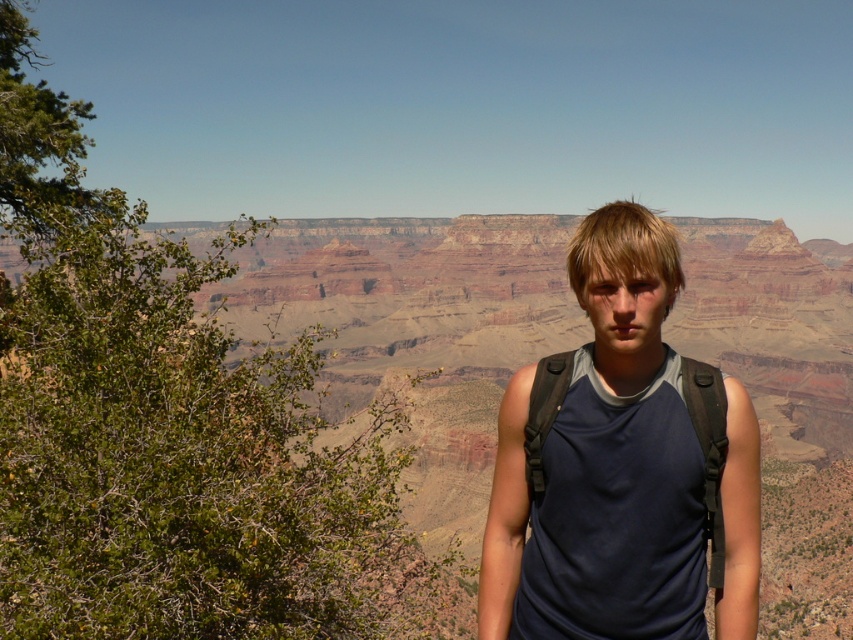
Looking at this image, does brown rock canyon at center appear on the right side of dark blue fabric tank top at center?

In fact, brown rock canyon at center is to the left of dark blue fabric tank top at center.

Where is `brown rock canyon at center`? This screenshot has width=853, height=640. brown rock canyon at center is located at coordinates (204, 461).